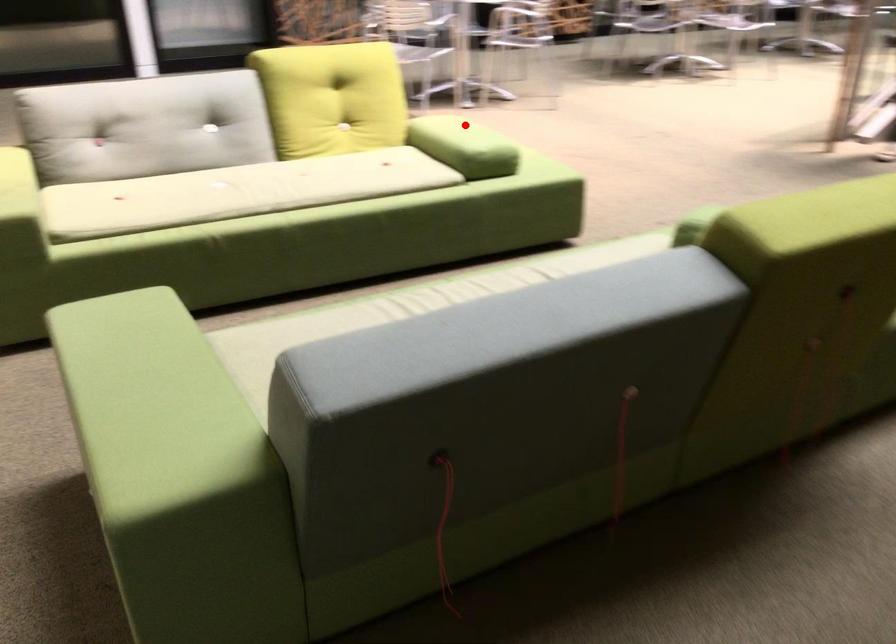
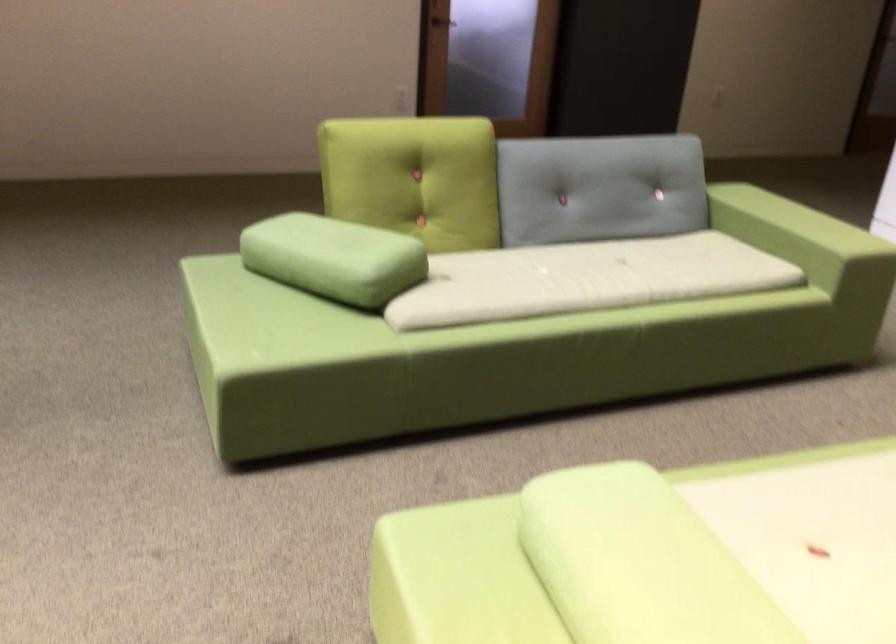
Find the pixel in the second image that matches the highlighted location in the first image.

(651, 556)